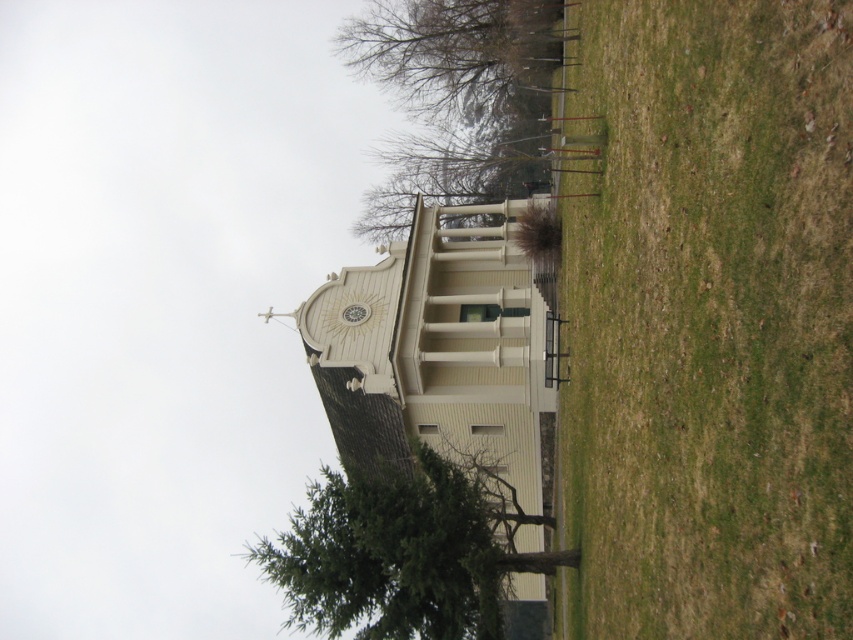
Is green grass at lower right smaller than green leafy tree at lower center?

Indeed, green grass at lower right has a smaller size compared to green leafy tree at lower center.

Does green grass at lower right have a greater height compared to green leafy tree at lower center?

Yes, green grass at lower right is taller than green leafy tree at lower center.

Is point (610, 432) farther from viewer compared to point (404, 566)?

No.

The width and height of the screenshot is (853, 640). Find the location of `green grass at lower right`. green grass at lower right is located at coordinates (711, 323).

Does green leafy tree at lower center come in front of green leafy tree at center?

That is True.

Does green leafy tree at lower center have a lesser width compared to green leafy tree at center?

Yes.

Between point (347, 616) and point (486, 116), which one is positioned in front?

Point (347, 616)

This screenshot has width=853, height=640. I want to click on green leafy tree at lower center, so click(397, 554).

Who is lower down, green grass at lower right or green leafy tree at center?

green grass at lower right is below.

Does green grass at lower right have a larger size compared to green leafy tree at center?

Actually, green grass at lower right might be smaller than green leafy tree at center.

Image resolution: width=853 pixels, height=640 pixels. Describe the element at coordinates (711, 323) in the screenshot. I see `green grass at lower right` at that location.

You are a GUI agent. You are given a task and a screenshot of the screen. Output one action in this format:
    pyautogui.click(x=<x>, y=<y>)
    Task: Click on the green grass at lower right
    The image size is (853, 640).
    Given the screenshot: What is the action you would take?
    [x=711, y=323]